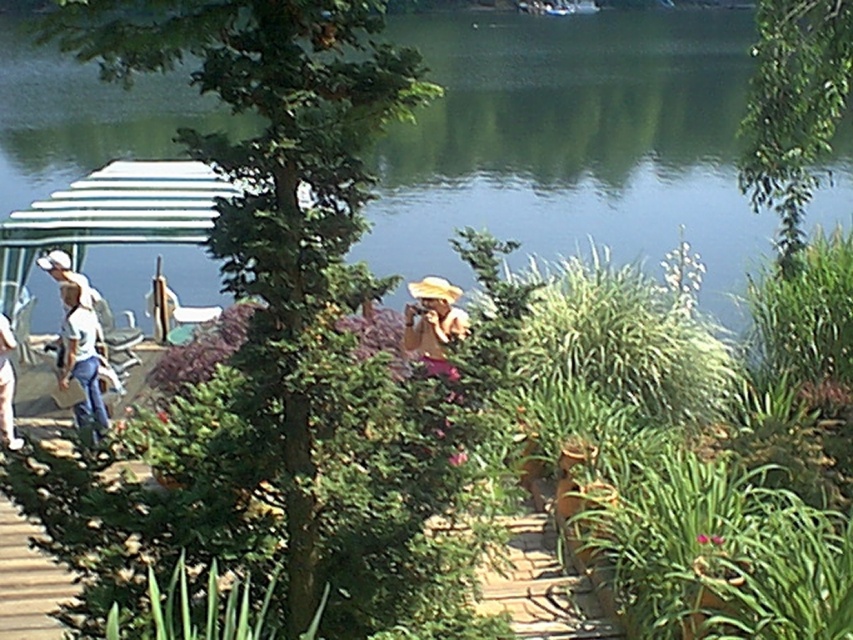
Question: Which point is closer to the camera?

Choices:
 (A) wooden deck at lower left
 (B) green leafy plant at center
 (C) pink fabric at center

Answer: (B)

Question: Does green water at center appear on the right side of pink fabric at center?

Choices:
 (A) no
 (B) yes

Answer: (B)

Question: Considering the real-world distances, which object is farthest from the green leafy plant at center?

Choices:
 (A) green water at center
 (B) wooden deck at lower left

Answer: (A)

Question: Can you confirm if wooden deck at lower left is positioned below green leafy plant at center?

Choices:
 (A) no
 (B) yes

Answer: (B)

Question: Among these objects, which one is farthest from the camera?

Choices:
 (A) pink fabric at center
 (B) wooden deck at lower left
 (C) green leafy plant at center
 (D) green water at center

Answer: (A)

Question: In this image, where is wooden deck at lower left located relative to green leafy plant at center?

Choices:
 (A) left
 (B) right

Answer: (A)